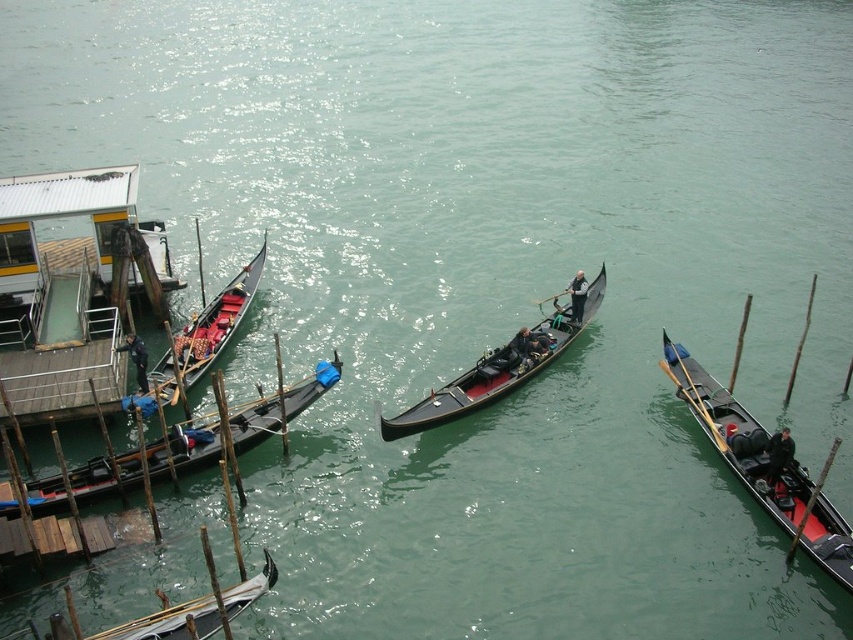
You are a tourist standing on a bridge overlooking the canal. You see the black polished gondola at right and the wooden paddle at right. Which object is positioned lower from your viewpoint?

The black polished gondola at right is positioned below the wooden paddle at right, so the black polished gondola at right is lower from your viewpoint.

You are a tourist standing on a bridge overlooking the canal. You notice the black polished gondola at right and the wooden paddle at right. Which object is higher in elevation?

The black polished gondola at right is taller than the wooden paddle at right, so the black polished gondola at right is higher in elevation.